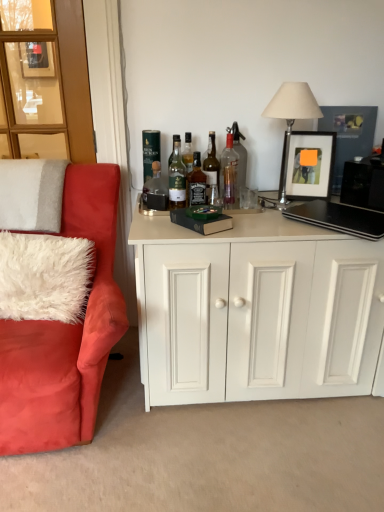
Question: Can you confirm if green glass bottle at upper center, the seventh bottle in the right-to-left sequence, is positioned to the left of wooden glass door at upper left?

Choices:
 (A) no
 (B) yes

Answer: (A)

Question: Is there a large distance between green glass bottle at upper center, the seventh bottle in the right-to-left sequence, and wooden glass door at upper left?

Choices:
 (A) no
 (B) yes

Answer: (A)

Question: Considering the relative positions of green glass bottle at upper center, which is counted as the 1th bottle, starting from the left, and wooden glass door at upper left in the image provided, is green glass bottle at upper center, which is counted as the 1th bottle, starting from the left, in front of wooden glass door at upper left?

Choices:
 (A) no
 (B) yes

Answer: (A)

Question: From a real-world perspective, is green glass bottle at upper center, which is counted as the 1th bottle, starting from the left, over wooden glass door at upper left?

Choices:
 (A) no
 (B) yes

Answer: (A)

Question: Does green glass bottle at upper center, which is counted as the 1th bottle, starting from the left, have a lesser width compared to wooden glass door at upper left?

Choices:
 (A) yes
 (B) no

Answer: (A)

Question: Is green glass bottle at upper center, the seventh bottle in the right-to-left sequence, facing towards wooden glass door at upper left?

Choices:
 (A) no
 (B) yes

Answer: (A)

Question: Is the surface of matte glass bottle at center, the sixth bottle positioned from the right, in direct contact with clear glass bottle at center, which is counted as the 7th bottle, starting from the left?

Choices:
 (A) no
 (B) yes

Answer: (A)

Question: From a real-world perspective, is matte glass bottle at center, the sixth bottle positioned from the right, beneath clear glass bottle at center, which is counted as the 7th bottle, starting from the left?

Choices:
 (A) no
 (B) yes

Answer: (B)

Question: Considering the relative positions of matte glass bottle at center, which appears as the second bottle when viewed from the left, and clear glass bottle at center, which is counted as the 7th bottle, starting from the left, in the image provided, is matte glass bottle at center, which appears as the second bottle when viewed from the left, in front of clear glass bottle at center, which is counted as the 7th bottle, starting from the left,?

Choices:
 (A) no
 (B) yes

Answer: (B)

Question: Considering the relative sizes of matte glass bottle at center, which appears as the second bottle when viewed from the left, and clear glass bottle at center, which is counted as the 7th bottle, starting from the left, in the image provided, is matte glass bottle at center, which appears as the second bottle when viewed from the left, thinner than clear glass bottle at center, which is counted as the 7th bottle, starting from the left,?

Choices:
 (A) no
 (B) yes

Answer: (A)

Question: Does matte glass bottle at center, the sixth bottle positioned from the right, lie behind clear glass bottle at center, which is counted as the 7th bottle, starting from the left?

Choices:
 (A) yes
 (B) no

Answer: (B)

Question: From a real-world perspective, is matte glass bottle at center, which appears as the second bottle when viewed from the left, positioned over clear glass bottle at center, placed as the 1th bottle when sorted from right to left, based on gravity?

Choices:
 (A) no
 (B) yes

Answer: (A)

Question: Considering the relative sizes of translucent glass bottle at center, acting as the fourth bottle starting from the left, and metallic silver table lamp at upper right in the image provided, is translucent glass bottle at center, acting as the fourth bottle starting from the left, thinner than metallic silver table lamp at upper right?

Choices:
 (A) no
 (B) yes

Answer: (B)